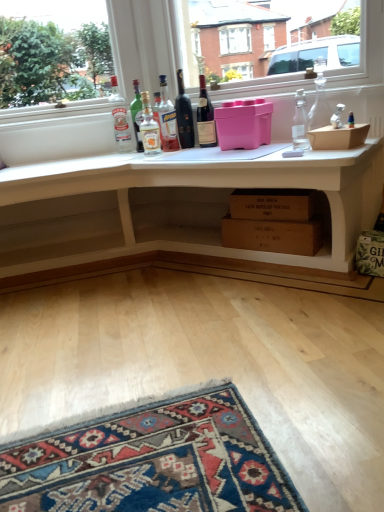
The height and width of the screenshot is (512, 384). I want to click on unoccupied area in front of pink plastic container at center, which ranks as the 1th box in top-to-bottom order, so click(238, 152).